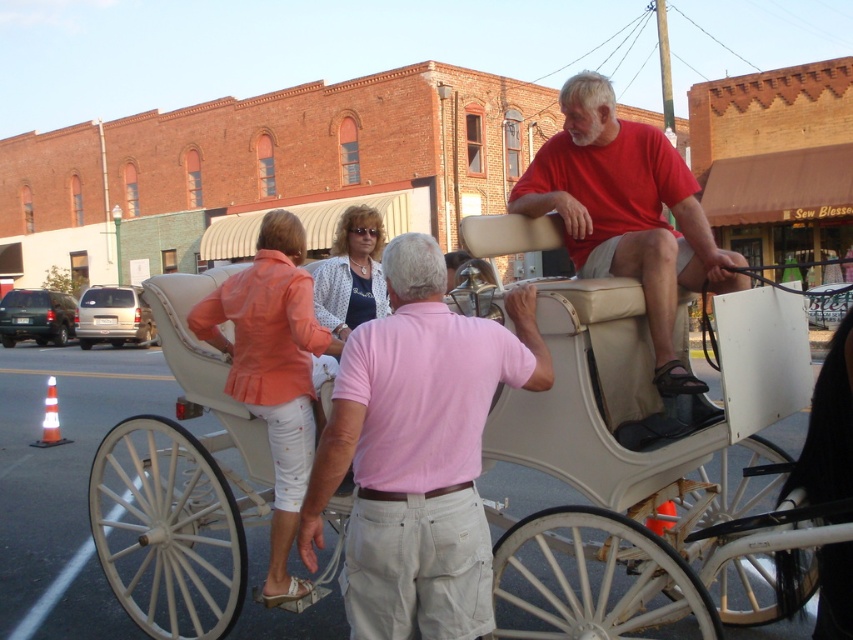
Does white leather horse cart at center have a larger size compared to polka dot blouse at center?

Indeed, white leather horse cart at center has a larger size compared to polka dot blouse at center.

Is white leather horse cart at center wider than polka dot blouse at center?

Correct, the width of white leather horse cart at center exceeds that of polka dot blouse at center.

Locate an element on the screen. white leather horse cart at center is located at coordinates (612, 460).

Is point (467, 221) closer to viewer compared to point (293, 413)?

Yes, it is.

Is white leather horse cart at center further to the viewer compared to orange fabric blouse at center?

No, it is not.

This screenshot has height=640, width=853. What are the coordinates of `white leather horse cart at center` in the screenshot? It's located at (612, 460).

Image resolution: width=853 pixels, height=640 pixels. What do you see at coordinates (627, 212) in the screenshot? I see `matte red shirt at center` at bounding box center [627, 212].

Is matte red shirt at center thinner than polka dot blouse at center?

No.

Where is `matte red shirt at center`? matte red shirt at center is located at coordinates (627, 212).

Identify the location of matte red shirt at center. This screenshot has width=853, height=640. (627, 212).